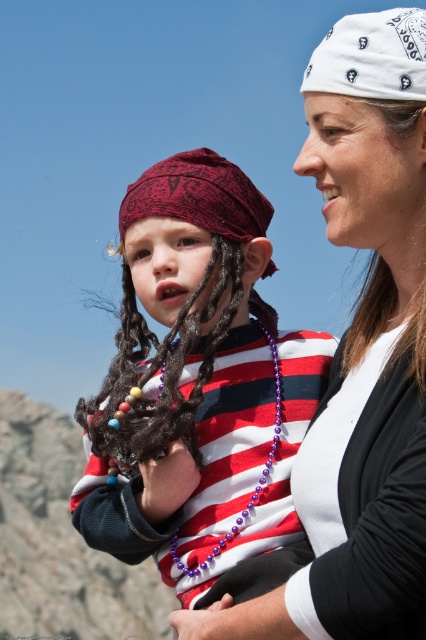
You are a photographer trying to capture the child in the image. You notice the white matte bandana at upper right and the purple beaded necklace at center. Which accessory is covering the other?

The white matte bandana at upper right is positioned over the purple beaded necklace at center, so it is covering the necklace.

Consider the image. You are an observer looking at the scene. You notice the white bandana at upper right and the purple beaded necklace at center. Which of these two items is shorter in length?

The white bandana at upper right is shorter than the purple beaded necklace at center.